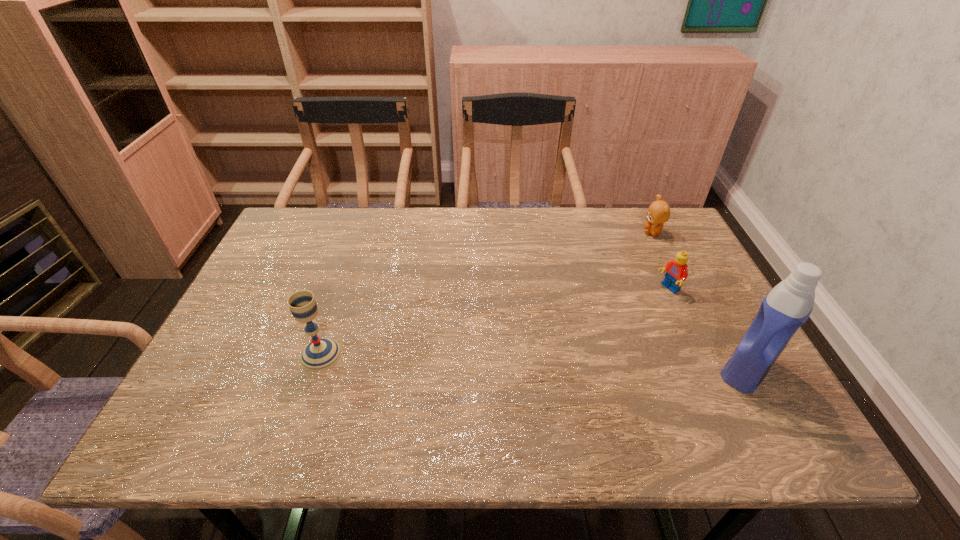
At what (x,y) coordinates should I click in order to perform the action: click on the second tallest object. Please return your answer as a coordinate pair (x, y). Looking at the image, I should click on (321, 353).

Locate an element on the screen. This screenshot has width=960, height=540. chalice is located at coordinates (321, 353).

Identify the location of the tallest object. [788, 305].

Locate an element on the screen. The image size is (960, 540). the third nearest object is located at coordinates (676, 270).

Locate an element on the screen. The height and width of the screenshot is (540, 960). the farthest object is located at coordinates (658, 213).

Image resolution: width=960 pixels, height=540 pixels. I want to click on free point located 0.340m on the back of the leftmost object, so click(355, 251).

Identify the location of vacant space located 0.290m on the left of the tallest object. (587, 369).

You are a GUI agent. You are given a task and a screenshot of the screen. Output one action in this format:
    pyautogui.click(x=<x>, y=<y>)
    Task: Click on the vacant space located 0.050m on the face of the Lego
    The width and height of the screenshot is (960, 540).
    Given the screenshot: What is the action you would take?
    pyautogui.click(x=647, y=300)

This screenshot has width=960, height=540. I want to click on vacant region located on the face of the Lego, so click(621, 313).

This screenshot has height=540, width=960. I want to click on free space located on the face of the Lego, so click(618, 314).